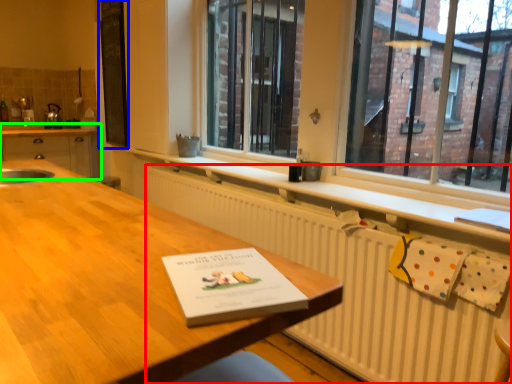
Question: Which is farther away from radiator (highlighted by a red box)? bulletin board (highlighted by a blue box) or cabinetry (highlighted by a green box)?

Choices:
 (A) bulletin board
 (B) cabinetry

Answer: (B)